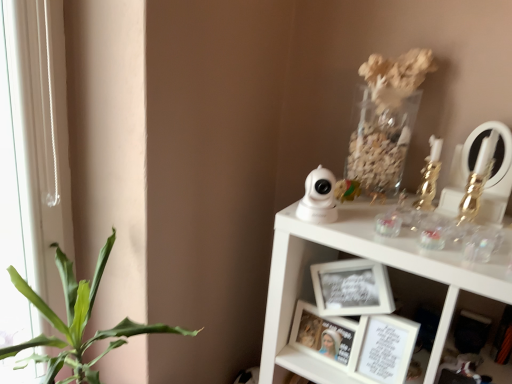
Describe the element at coordinates (322, 335) in the screenshot. I see `matte white picture frame at center, the 1th picture frame from the left` at that location.

Image resolution: width=512 pixels, height=384 pixels. Describe the element at coordinates (429, 176) in the screenshot. I see `gold metallic candle holder at upper right` at that location.

Identify the location of matte white picture frame at center, the 1th picture frame from the left. (322, 335).

In the scene shown: Considering the positions of objects green leafy plant at left and gold metallic candlestick at upper right, the 2th toy viewed from the left, in the image provided, who is more to the right, green leafy plant at left or gold metallic candlestick at upper right, the 2th toy viewed from the left,?

Positioned to the right is gold metallic candlestick at upper right, the 2th toy viewed from the left.

Can you tell me how much green leafy plant at left and gold metallic candlestick at upper right, which ranks as the first toy in right-to-left order, differ in facing direction?

The facing directions of green leafy plant at left and gold metallic candlestick at upper right, which ranks as the first toy in right-to-left order, are 93.9 degrees apart.

In terms of height, does green leafy plant at left look taller or shorter compared to gold metallic candlestick at upper right, the 2th toy viewed from the left?

Considering their sizes, green leafy plant at left has more height than gold metallic candlestick at upper right, the 2th toy viewed from the left.

Is point (72, 369) positioned before point (480, 156)?

No, (72, 369) is behind (480, 156).

From the image's perspective, is matte white picture frame at center, the 2th picture frame in the right-to-left sequence, above or below white glossy security camera at upper right, arranged as the 1th toy when viewed from the left?

Based on their image positions, matte white picture frame at center, the 2th picture frame in the right-to-left sequence, is located beneath white glossy security camera at upper right, arranged as the 1th toy when viewed from the left.

Between matte white picture frame at center, the 1th picture frame from the left, and white glossy security camera at upper right, which is counted as the second toy, starting from the right, which one is positioned behind?

matte white picture frame at center, the 1th picture frame from the left, is behind.

Based on the photo, which point is more forward, (339, 335) or (336, 217)?

The point (336, 217) is in front.

Which of these two, matte white picture frame at center, the 1th picture frame from the left, or white glossy security camera at upper right, which is counted as the second toy, starting from the right, stands taller?

matte white picture frame at center, the 1th picture frame from the left, is taller.

Is white glossy security camera at upper right, arranged as the 1th toy when viewed from the left, bigger or smaller than green leafy plant at left?

Considering their sizes, white glossy security camera at upper right, arranged as the 1th toy when viewed from the left, takes up less space than green leafy plant at left.

Which is less distant, (329, 199) or (90, 342)?

The point (329, 199) is closer to the camera.

Which object is more forward, white glossy security camera at upper right, which is counted as the second toy, starting from the right, or green leafy plant at left?

Positioned in front is green leafy plant at left.

What's the angular difference between white glossy security camera at upper right, arranged as the 1th toy when viewed from the left, and green leafy plant at left's facing directions?

93.5 degrees separate the facing orientations of white glossy security camera at upper right, arranged as the 1th toy when viewed from the left, and green leafy plant at left.

Is green leafy plant at left directly adjacent to gold metallic candle holder at upper right?

No, green leafy plant at left is not in contact with gold metallic candle holder at upper right.

From the picture: How distant is green leafy plant at left from gold metallic candle holder at upper right?

33.42 inches.

From the image's perspective, which one is positioned lower, green leafy plant at left or gold metallic candle holder at upper right?

green leafy plant at left, from the image's perspective.

From a real-world perspective, does green leafy plant at left sit lower than gold metallic candle holder at upper right?

Yes, from a real-world perspective, green leafy plant at left is below gold metallic candle holder at upper right.

From the image's perspective, which object appears higher, gold metallic candle holder at upper right or matte white picture frame at center, the 1th picture frame from the left?

gold metallic candle holder at upper right is shown above in the image.

Is gold metallic candle holder at upper right turned away from matte white picture frame at center, the 2th picture frame in the right-to-left sequence?

No, matte white picture frame at center, the 2th picture frame in the right-to-left sequence, is not at the back of gold metallic candle holder at upper right.

Identify the location of the 2nd picture frame positioned below the gold metallic candle holder at upper right (from a real-world perspective). The image size is (512, 384). (322, 335).

Which object is further away from the camera taking this photo, gold metallic candle holder at upper right or matte white picture frame at center, the 1th picture frame from the left?

gold metallic candle holder at upper right is more distant.

From the image's perspective, which one is positioned higher, matte white picture frame at center, the 2th picture frame in the right-to-left sequence, or gold metallic candlestick at upper right, which ranks as the first toy in right-to-left order?

From the image's view, gold metallic candlestick at upper right, which ranks as the first toy in right-to-left order, is above.

Considering the positions of objects matte white picture frame at center, the 1th picture frame from the left, and gold metallic candlestick at upper right, which ranks as the first toy in right-to-left order, in the image provided, who is more to the left, matte white picture frame at center, the 1th picture frame from the left, or gold metallic candlestick at upper right, which ranks as the first toy in right-to-left order,?

Positioned to the left is matte white picture frame at center, the 1th picture frame from the left.

I want to click on the 2nd picture frame counting from the left side of the gold metallic candlestick at upper right, which ranks as the first toy in right-to-left order, so click(x=322, y=335).

Is there a large distance between matte white picture frame at center, the 1th picture frame from the left, and gold metallic candlestick at upper right, which ranks as the first toy in right-to-left order?

They are positioned close to each other.

Locate an element on the screen. This screenshot has height=384, width=512. toy positioned vertically above the gold metallic candle holder at upper right (from a real-world perspective) is located at coordinates pyautogui.click(x=475, y=188).

From a real-world perspective, is gold metallic candle holder at upper right over gold metallic candlestick at upper right, the 2th toy viewed from the left?

No, from a real-world perspective, gold metallic candle holder at upper right is not on top of gold metallic candlestick at upper right, the 2th toy viewed from the left.

Considering their positions, is gold metallic candle holder at upper right located in front of or behind gold metallic candlestick at upper right, which ranks as the first toy in right-to-left order?

A: In the image, gold metallic candle holder at upper right appears behind gold metallic candlestick at upper right, which ranks as the first toy in right-to-left order.

How different are the orientations of gold metallic candle holder at upper right and gold metallic candlestick at upper right, which ranks as the first toy in right-to-left order, in degrees?

There is a 0.000641-degree angle between the facing directions of gold metallic candle holder at upper right and gold metallic candlestick at upper right, which ranks as the first toy in right-to-left order.

At what (x,y) coordinates should I click in order to perform the action: click on houseplant below the gold metallic candlestick at upper right, the 2th toy viewed from the left (from a real-world perspective). Please return your answer as a coordinate pair (x, y). This screenshot has width=512, height=384. Looking at the image, I should click on (78, 321).

From a real-world perspective, count 1st toys upward from the matte white picture frame at center, the 2th picture frame in the right-to-left sequence, and point to it. Please provide its 2D coordinates.

[(318, 197)]

Estimate the real-world distances between objects in this image. Which object is further from gold metallic candlestick at upper right, the 2th toy viewed from the left, white glossy security camera at upper right, which is counted as the second toy, starting from the right, or white matte picture frame at lower center, which is counted as the first picture frame, starting from the right?

white matte picture frame at lower center, which is counted as the first picture frame, starting from the right, is positioned further to the anchor gold metallic candlestick at upper right, the 2th toy viewed from the left.

From the image, which object appears to be farther from white glossy security camera at upper right, which is counted as the second toy, starting from the right, white matte picture frame at lower center, placed as the second picture frame when sorted from left to right, or green leafy plant at left?

green leafy plant at left is further to white glossy security camera at upper right, which is counted as the second toy, starting from the right.

From the image, which object appears to be nearer to matte white picture frame at center, the 2th picture frame in the right-to-left sequence, gold metallic candle holder at upper right or green leafy plant at left?

gold metallic candle holder at upper right.

Looking at this image, which object lies nearer to the anchor point gold metallic candlestick at upper right, which ranks as the first toy in right-to-left order, white matte picture frame at lower center, placed as the second picture frame when sorted from left to right, or matte white picture frame at center, the 2th picture frame in the right-to-left sequence?

The object closer to gold metallic candlestick at upper right, which ranks as the first toy in right-to-left order, is white matte picture frame at lower center, placed as the second picture frame when sorted from left to right.

From the image, which object appears to be farther from gold metallic candlestick at upper right, the 2th toy viewed from the left, matte white picture frame at center, the 1th picture frame from the left, or white matte picture frame at lower center, placed as the second picture frame when sorted from left to right?

The object further to gold metallic candlestick at upper right, the 2th toy viewed from the left, is matte white picture frame at center, the 1th picture frame from the left.

When comparing their distances from white matte picture frame at lower center, which is counted as the first picture frame, starting from the right, does matte white picture frame at center, the 2th picture frame in the right-to-left sequence, or gold metallic candle holder at upper right seem closer?

Among the two, matte white picture frame at center, the 2th picture frame in the right-to-left sequence, is located nearer to white matte picture frame at lower center, which is counted as the first picture frame, starting from the right.

From the image, which object appears to be nearer to green leafy plant at left, white matte picture frame at lower center, placed as the second picture frame when sorted from left to right, or gold metallic candle holder at upper right?

Based on the image, white matte picture frame at lower center, placed as the second picture frame when sorted from left to right, appears to be nearer to green leafy plant at left.

Which object lies further to the anchor point green leafy plant at left, white glossy security camera at upper right, arranged as the 1th toy when viewed from the left, or gold metallic candle holder at upper right?

The object further to green leafy plant at left is gold metallic candle holder at upper right.

This screenshot has height=384, width=512. Identify the location of toy between green leafy plant at left and gold metallic candle holder at upper right. (318, 197).

The height and width of the screenshot is (384, 512). In order to click on candle holder located between green leafy plant at left and gold metallic candlestick at upper right, the 2th toy viewed from the left, in the left-right direction in this screenshot , I will do `click(429, 176)`.

Where is `toy located between green leafy plant at left and white matte picture frame at lower center, which is counted as the first picture frame, starting from the right, in the left-right direction`? toy located between green leafy plant at left and white matte picture frame at lower center, which is counted as the first picture frame, starting from the right, in the left-right direction is located at coordinates (318, 197).

The image size is (512, 384). Identify the location of picture frame between white glossy security camera at upper right, arranged as the 1th toy when viewed from the left, and white matte picture frame at lower center, placed as the second picture frame when sorted from left to right, from top to bottom. (322, 335).